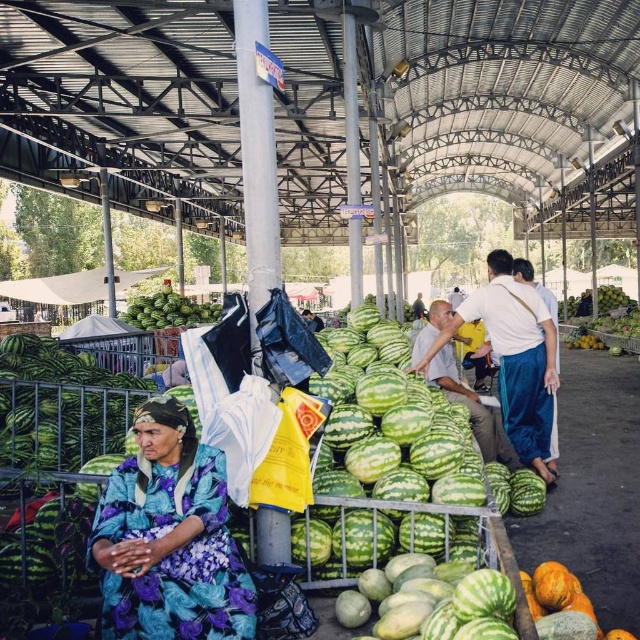
Measure the distance between point (112, 545) and camera.

Point (112, 545) and camera are 12.83 feet apart from each other.

Does floral fabric dress at lower left have a greater width compared to smooth white shirt at center?

Incorrect, floral fabric dress at lower left's width does not surpass smooth white shirt at center's.

Is point (161, 552) farther from viewer compared to point (531, 328)?

No, it is in front of (531, 328).

Where is `floral fabric dress at lower left`? This screenshot has width=640, height=640. floral fabric dress at lower left is located at coordinates (170, 538).

Between point (516, 280) and point (193, 323), which one is positioned in front?

Positioned in front is point (516, 280).

Is smooth white shirt at center to the right of green matte watermelon at center from the viewer's perspective?

Correct, you'll find smooth white shirt at center to the right of green matte watermelon at center.

Does point (497, 323) come in front of point (163, 300)?

That is True.

Where is `smooth white shirt at center`? The image size is (640, 640). smooth white shirt at center is located at coordinates (515, 358).

Does floral fabric dress at lower left have a lesser height compared to green matte watermelon at center?

Incorrect, floral fabric dress at lower left's height does not fall short of green matte watermelon at center's.

Image resolution: width=640 pixels, height=640 pixels. What do you see at coordinates (170, 538) in the screenshot? I see `floral fabric dress at lower left` at bounding box center [170, 538].

Does point (180, 596) lie behind point (200, 321)?

No, (180, 596) is closer to viewer.

Where is `floral fabric dress at lower left`? The image size is (640, 640). floral fabric dress at lower left is located at coordinates (170, 538).